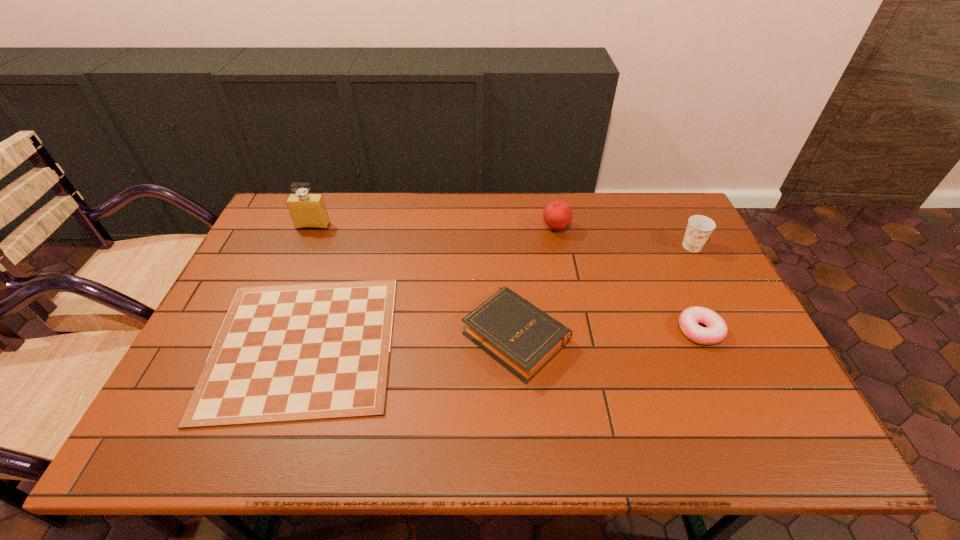
Where is `perfume`? This screenshot has height=540, width=960. perfume is located at coordinates (307, 210).

Find the location of a particular element. This screenshot has height=540, width=960. apple is located at coordinates tap(557, 214).

Find the location of a particular element. The width and height of the screenshot is (960, 540). Dixie cup is located at coordinates (699, 228).

Locate an element on the screen. the fourth tallest object is located at coordinates (521, 337).

At what (x,y) coordinates should I click in order to perform the action: click on the fifth tallest object. Please return your answer as a coordinate pair (x, y). Image resolution: width=960 pixels, height=540 pixels. Looking at the image, I should click on (716, 331).

Locate an element on the screen. The width and height of the screenshot is (960, 540). checkerboard is located at coordinates (299, 352).

Where is `free region located 0.240m on the front-facing side of the perfume`? free region located 0.240m on the front-facing side of the perfume is located at coordinates [289, 282].

Where is `vacant space located 0.140m on the left of the apple`? vacant space located 0.140m on the left of the apple is located at coordinates (499, 228).

You are a GUI agent. You are given a task and a screenshot of the screen. Output one action in this format:
    pyautogui.click(x=<x>, y=<y>)
    Task: Click on the free space located on the front of the third farthest object
    The image size is (960, 540).
    Given the screenshot: What is the action you would take?
    pyautogui.click(x=714, y=289)

Locate an element on the screen. This screenshot has width=960, height=540. free space located 0.090m on the right of the Bible is located at coordinates (604, 335).